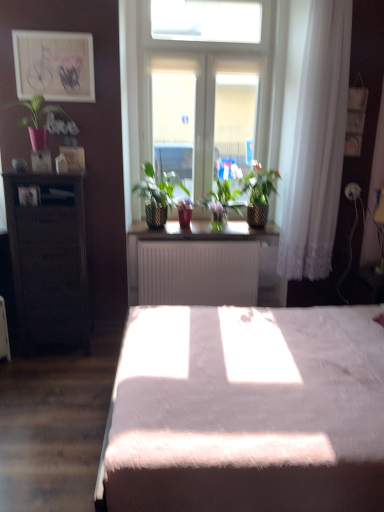
You are a GUI agent. You are given a task and a screenshot of the screen. Output one action in this format:
    pyautogui.click(x=<x>, y=<y>)
    Task: Click on the white lace curtain at right
    
    Given the screenshot: What is the action you would take?
    pyautogui.click(x=317, y=145)

Describe the element at coordinates (158, 194) in the screenshot. I see `green woven basket at center, which ranks as the second houseplant in left-to-right order` at that location.

Based on the photo, how much space does green woven basket at center, which ranks as the second houseplant in left-to-right order, occupy horizontally?

It is 12.15 inches.

Describe the element at coordinates (54, 65) in the screenshot. I see `matte wooden picture frame at upper left` at that location.

This screenshot has width=384, height=512. Describe the element at coordinates (221, 203) in the screenshot. I see `green matte plant at center, which is counted as the 3th houseplant, starting from the left` at that location.

Describe the element at coordinates (196, 88) in the screenshot. I see `white glass window at center` at that location.

Where is `white fluffy bed at center`? The width and height of the screenshot is (384, 512). white fluffy bed at center is located at coordinates (246, 411).

From the image's perspective, which is below, matte pink pot at upper left, the first houseplant positioned from the left, or green woven basket at center, which is the third houseplant in right-to-left order?

green woven basket at center, which is the third houseplant in right-to-left order, from the image's perspective.

Is matte pink pot at upper left, the first houseplant positioned from the left, bigger or smaller than green woven basket at center, which is the third houseplant in right-to-left order?

Considering their sizes, matte pink pot at upper left, the first houseplant positioned from the left, takes up less space than green woven basket at center, which is the third houseplant in right-to-left order.

Is point (28, 109) farther from camera compared to point (162, 179)?

That is False.

Looking at this image, which object is closer to the camera taking this photo, matte pink pot at upper left, positioned as the fourth houseplant in right-to-left order, or green woven basket at center, which is the third houseplant in right-to-left order?

matte pink pot at upper left, positioned as the fourth houseplant in right-to-left order, is in front.

What's the angular difference between white matte radiator at center, which ranks as the 1th table in back-to-front order, and matte pink pot at upper left, positioned as the fourth houseplant in right-to-left order,'s facing directions?

They differ by 5.44e-05 degrees in their facing directions.

Who is shorter, white matte radiator at center, which ranks as the 1th table in back-to-front order, or matte pink pot at upper left, positioned as the fourth houseplant in right-to-left order?

matte pink pot at upper left, positioned as the fourth houseplant in right-to-left order.

Can you see white matte radiator at center, which ranks as the 1th table in back-to-front order, touching matte pink pot at upper left, positioned as the fourth houseplant in right-to-left order?

No, white matte radiator at center, which ranks as the 1th table in back-to-front order, is not next to matte pink pot at upper left, positioned as the fourth houseplant in right-to-left order.

Considering the positions of point (193, 276) and point (29, 129), is point (193, 276) closer or farther from the camera than point (29, 129)?

Clearly, point (193, 276) is more distant from the camera than point (29, 129).

Do you think white matte radiator at center, the second table in the front-to-back sequence, is within matte wooden picture frame at upper left, or outside of it?

white matte radiator at center, the second table in the front-to-back sequence, exists outside the volume of matte wooden picture frame at upper left.

Does white matte radiator at center, the second table positioned from the left, have a greater height compared to matte wooden picture frame at upper left?

Yes.

Looking at this image, from the image's perspective, is white matte radiator at center, the 1th table positioned from the right, positioned above or below matte wooden picture frame at upper left?

white matte radiator at center, the 1th table positioned from the right, is below matte wooden picture frame at upper left.

Consider the image. Considering the sizes of objects matte wooden picture frame at upper left and green matte plant at center, which is the second houseplant in right-to-left order, in the image provided, who is bigger, matte wooden picture frame at upper left or green matte plant at center, which is the second houseplant in right-to-left order,?

With larger size is green matte plant at center, which is the second houseplant in right-to-left order.

Is point (49, 58) positioned after point (223, 181)?

No, (49, 58) is closer to viewer.

Is matte wooden picture frame at upper left at the left side of green matte plant at center, which is counted as the 3th houseplant, starting from the left?

Yes, matte wooden picture frame at upper left is to the left of green matte plant at center, which is counted as the 3th houseplant, starting from the left.

Is white lace curtain at right positioned with its back to white matte radiator at center, which ranks as the 1th table in back-to-front order?

No.

Looking at this image, considering the relative sizes of white lace curtain at right and white matte radiator at center, the second table in the front-to-back sequence, in the image provided, is white lace curtain at right shorter than white matte radiator at center, the second table in the front-to-back sequence,?

Incorrect, the height of white lace curtain at right does not fall short of that of white matte radiator at center, the second table in the front-to-back sequence.

Can you confirm if white lace curtain at right is smaller than white matte radiator at center, the 1th table positioned from the right?

Yes, white lace curtain at right is smaller than white matte radiator at center, the 1th table positioned from the right.

Choose the correct answer: Is dark wood cabinet at left, positioned as the 1th table in front-to-back order, inside green woven basket at center, which ranks as the second houseplant in left-to-right order, or outside it?

dark wood cabinet at left, positioned as the 1th table in front-to-back order, is not enclosed by green woven basket at center, which ranks as the second houseplant in left-to-right order.

From a real-world perspective, is dark wood cabinet at left, positioned as the 1th table in front-to-back order, over green woven basket at center, which is the third houseplant in right-to-left order?

Actually, dark wood cabinet at left, positioned as the 1th table in front-to-back order, is physically below green woven basket at center, which is the third houseplant in right-to-left order, in the real world.

From the image's perspective, is dark wood cabinet at left, marked as the 2th table in a right-to-left arrangement, located above green woven basket at center, which is the third houseplant in right-to-left order?

Incorrect, from the image's perspective, dark wood cabinet at left, marked as the 2th table in a right-to-left arrangement, is lower than green woven basket at center, which is the third houseplant in right-to-left order.

Can you confirm if dark wood cabinet at left, marked as the 2th table in a right-to-left arrangement, is positioned to the right of green woven basket at center, which ranks as the second houseplant in left-to-right order?

Incorrect, dark wood cabinet at left, marked as the 2th table in a right-to-left arrangement, is not on the right side of green woven basket at center, which ranks as the second houseplant in left-to-right order.

Does matte wooden picture frame at upper left lie in front of dark wood cabinet at left, which is the 2th table from back to front?

That is False.

Is matte wooden picture frame at upper left inside or outside of dark wood cabinet at left, marked as the 2th table in a right-to-left arrangement?

matte wooden picture frame at upper left is not enclosed by dark wood cabinet at left, marked as the 2th table in a right-to-left arrangement.

Identify the location of picture frame above the dark wood cabinet at left, acting as the 1th table starting from the left (from the image's perspective). The height and width of the screenshot is (512, 384). (54, 65).

From a real-world perspective, which houseplant is the 2nd one underneath the matte pink pot at upper left, the first houseplant positioned from the left? Please provide its 2D coordinates.

[(158, 194)]

Locate an element on the screen. the 2nd table below the matte pink pot at upper left, the first houseplant positioned from the left (from the image's perspective) is located at coordinates (203, 265).

Looking at the image, which one is located closer to matte wooden picture frame at upper left, green textured plant at center, the 4th houseplant from the left, or dark wood cabinet at left, acting as the 1th table starting from the left?

dark wood cabinet at left, acting as the 1th table starting from the left, lies closer to matte wooden picture frame at upper left than the other object.

Estimate the real-world distances between objects in this image. Which object is further from white glass window at center, white matte radiator at center, the 1th table positioned from the right, or green matte plant at center, which is counted as the 3th houseplant, starting from the left?

white matte radiator at center, the 1th table positioned from the right, is further to white glass window at center.

From the image, which object appears to be farther from matte pink pot at upper left, positioned as the fourth houseplant in right-to-left order, white glass window at center or green matte plant at center, which is counted as the 3th houseplant, starting from the left?

The object further to matte pink pot at upper left, positioned as the fourth houseplant in right-to-left order, is green matte plant at center, which is counted as the 3th houseplant, starting from the left.

Based on their spatial positions, is white fluffy bed at center or matte wooden picture frame at upper left further from green matte plant at center, which is counted as the 3th houseplant, starting from the left?

white fluffy bed at center is positioned further to the anchor green matte plant at center, which is counted as the 3th houseplant, starting from the left.

Considering their positions, is white fluffy bed at center positioned closer to white glass window at center than green woven basket at center, which ranks as the second houseplant in left-to-right order?

Based on the image, green woven basket at center, which ranks as the second houseplant in left-to-right order, appears to be nearer to white glass window at center.

From the image, which object appears to be farther from matte wooden picture frame at upper left, white lace curtain at right or white fluffy bed at center?

white fluffy bed at center is positioned further to the anchor matte wooden picture frame at upper left.

Based on their spatial positions, is matte wooden picture frame at upper left or white glass window at center further from green woven basket at center, which is the third houseplant in right-to-left order?

matte wooden picture frame at upper left is further to green woven basket at center, which is the third houseplant in right-to-left order.

Estimate the real-world distances between objects in this image. Which object is closer to green woven basket at center, which is the third houseplant in right-to-left order, green textured plant at center, the 4th houseplant from the left, or white glass window at center?

white glass window at center.

Identify the location of table that lies between matte wooden picture frame at upper left and white matte radiator at center, the 1th table positioned from the right, from top to bottom. (49, 260).

Image resolution: width=384 pixels, height=512 pixels. I want to click on picture frame between white fluffy bed at center and green woven basket at center, which is the third houseplant in right-to-left order, in the front-back direction, so click(54, 65).

Where is `houseplant between matte pink pot at upper left, positioned as the fourth houseplant in right-to-left order, and white matte radiator at center, the 1th table positioned from the right, from left to right`? houseplant between matte pink pot at upper left, positioned as the fourth houseplant in right-to-left order, and white matte radiator at center, the 1th table positioned from the right, from left to right is located at coordinates (158, 194).

Find the location of `curtain between white glass window at center and white matte radiator at center, the second table positioned from the left, vertically`. curtain between white glass window at center and white matte radiator at center, the second table positioned from the left, vertically is located at coordinates (317, 145).